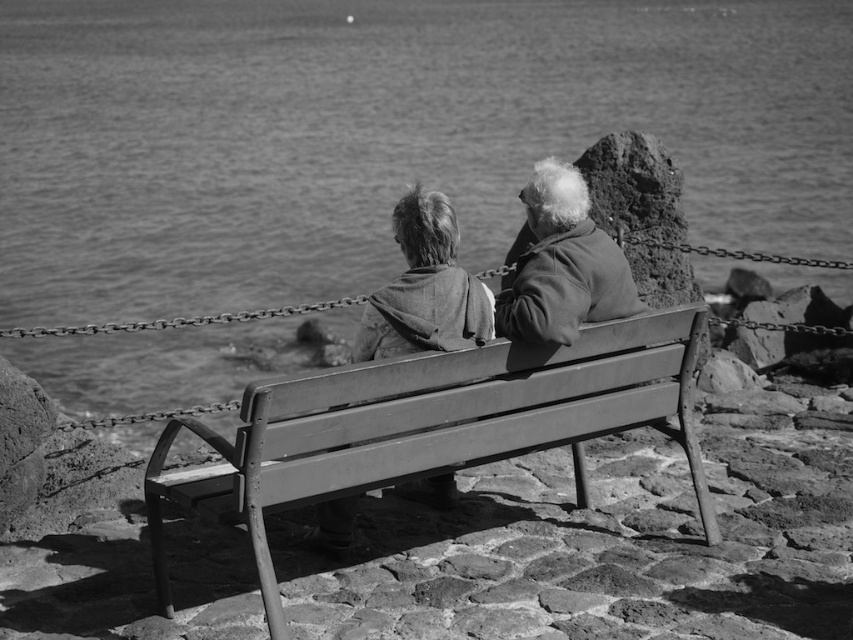
Does point (25, 112) come in front of point (677, 378)?

No, it is behind (677, 378).

This screenshot has height=640, width=853. What do you see at coordinates (384, 134) in the screenshot?
I see `smooth water at bench center` at bounding box center [384, 134].

Who is more distant from viewer, (x=157, y=276) or (x=245, y=394)?

The point (x=157, y=276) is behind.

At what (x,y) coordinates should I click in order to perform the action: click on smooth water at bench center. Please return your answer as a coordinate pair (x, y). The image size is (853, 640). Looking at the image, I should click on (384, 134).

Who is positioned more to the left, smooth water at bench center or coarse fabric jacket at center?

From the viewer's perspective, smooth water at bench center appears more on the left side.

Does point (451, 189) come behind point (425, 237)?

Yes, it is behind point (425, 237).

Locate an element on the screen. The image size is (853, 640). smooth water at bench center is located at coordinates (384, 134).

Locate an element on the screen. This screenshot has width=853, height=640. smooth water at bench center is located at coordinates (384, 134).

Is metal bench at center behind coarse fabric jacket at center?

No, it is not.

Is metal bench at center below coarse fabric jacket at center?

Yes.

This screenshot has width=853, height=640. In order to click on metal bench at center in this screenshot , I will do `click(432, 426)`.

The width and height of the screenshot is (853, 640). What are the coordinates of `metal bench at center` in the screenshot? It's located at (432, 426).